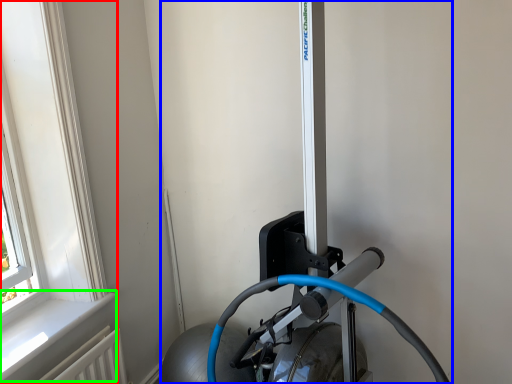
Question: Based on their relative distances, which object is farther from window (highlighted by a red box)? Choose from sport equipment (highlighted by a blue box) and window sill (highlighted by a green box).

Choices:
 (A) sport equipment
 (B) window sill

Answer: (A)